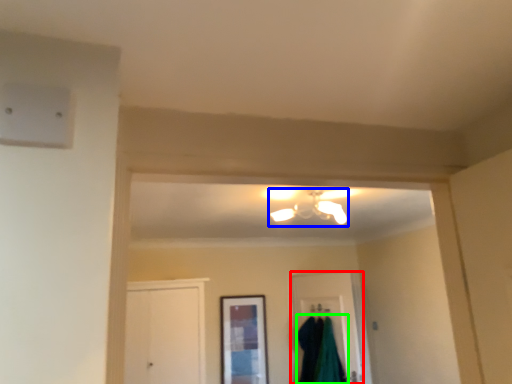
Question: Estimate the real-world distances between objects in this image. Which object is closer to door (highlighted by a red box), light fixture (highlighted by a blue box) or robe (highlighted by a green box)?

Choices:
 (A) light fixture
 (B) robe

Answer: (B)